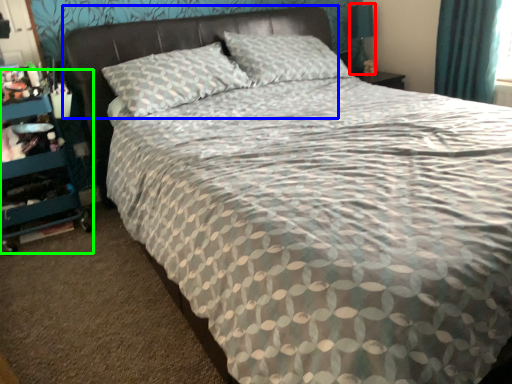
Question: Based on their relative distances, which object is nearer to table lamp (highlighted by a red box)? Choose from headboard (highlighted by a blue box) and dresser (highlighted by a green box).

Choices:
 (A) headboard
 (B) dresser

Answer: (A)